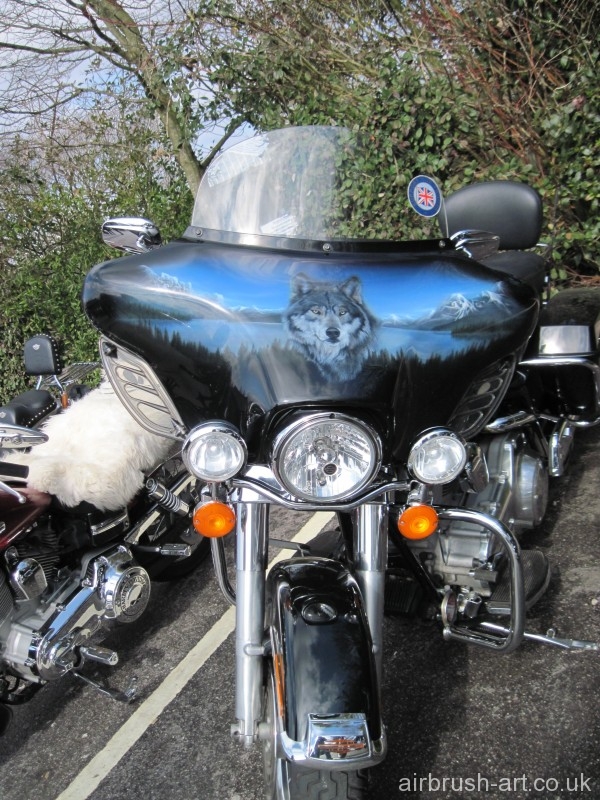
Find the location of a particular element. Image resolution: width=600 pixels, height=800 pixels. black leather seats is located at coordinates (36, 354), (25, 410), (508, 214), (522, 282).